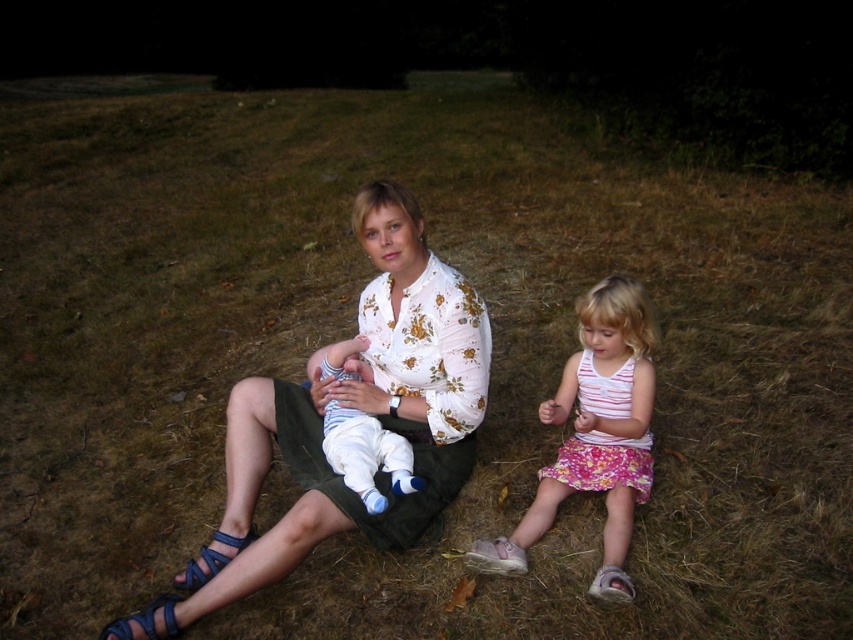
Is pink floral dress at lower right in front of white cotton baby at center?

Yes.

Looking at this image, which is above, pink floral dress at lower right or white cotton baby at center?

Positioned higher is white cotton baby at center.

Where is `pink floral dress at lower right`? Image resolution: width=853 pixels, height=640 pixels. pink floral dress at lower right is located at coordinates (595, 435).

Does point (469, 388) come farther from viewer compared to point (619, 592)?

Yes.

Who is positioned more to the left, floral cotton blouse at center or pink floral dress at lower right?

From the viewer's perspective, floral cotton blouse at center appears more on the left side.

The height and width of the screenshot is (640, 853). I want to click on floral cotton blouse at center, so click(x=349, y=406).

Can you confirm if floral cotton blouse at center is bigger than white cotton baby at center?

Correct, floral cotton blouse at center is larger in size than white cotton baby at center.

Describe the element at coordinates (349, 406) in the screenshot. I see `floral cotton blouse at center` at that location.

Find the location of `floral cotton blouse at center`. floral cotton blouse at center is located at coordinates (349, 406).